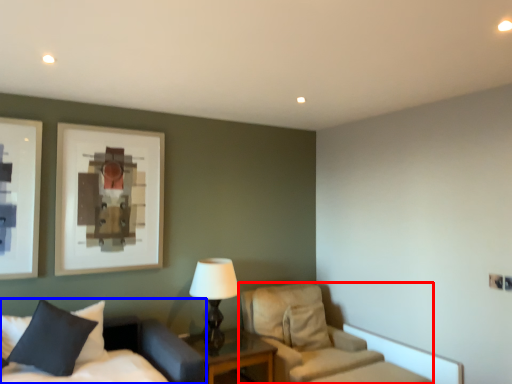
Question: Which object is closer to the camera taking this photo, chair (highlighted by a red box) or bed (highlighted by a blue box)?

Choices:
 (A) chair
 (B) bed

Answer: (B)